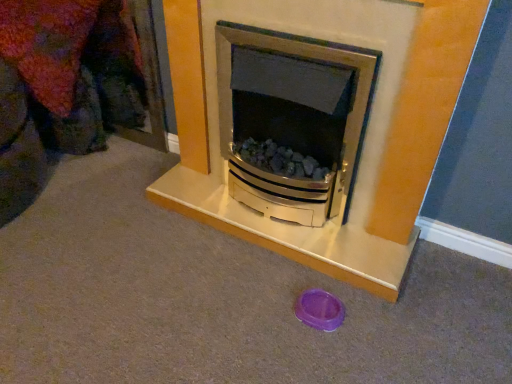
Locate an element on the screen. The height and width of the screenshot is (384, 512). free location to the left of metallic silver fireplace at center is located at coordinates (115, 234).